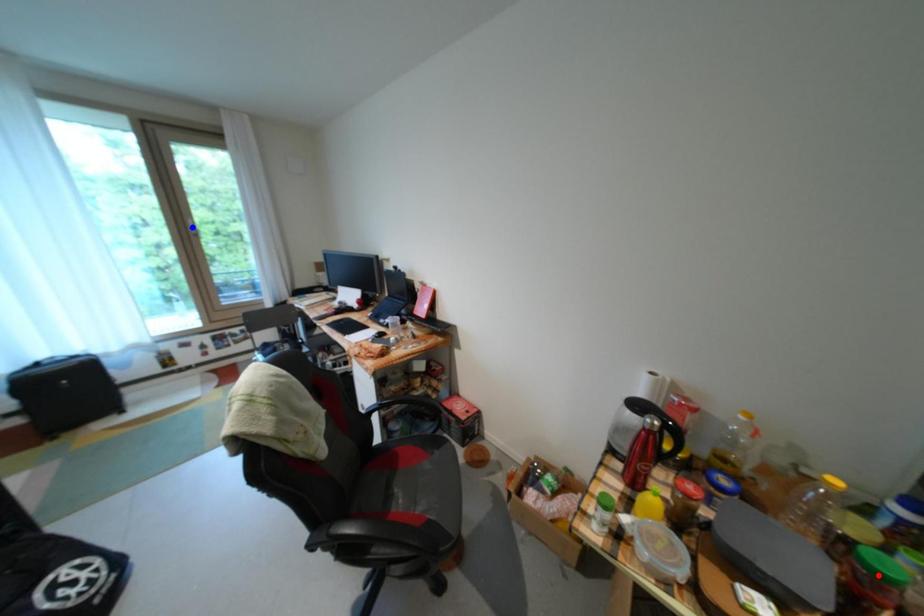
Question: In the image, two points are highlighted. Which point is nearer to the camera? Reply with the corresponding letter.

Choices:
 (A) blue point
 (B) red point

Answer: (B)